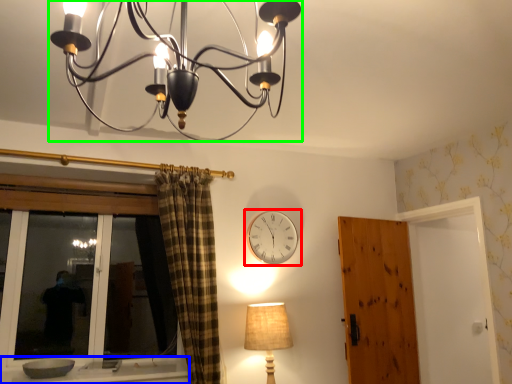
Question: Which object is the farthest from wall clock (highlighted by a red box)? Choose among these: window sill (highlighted by a blue box) or lamp (highlighted by a green box).

Choices:
 (A) window sill
 (B) lamp

Answer: (B)